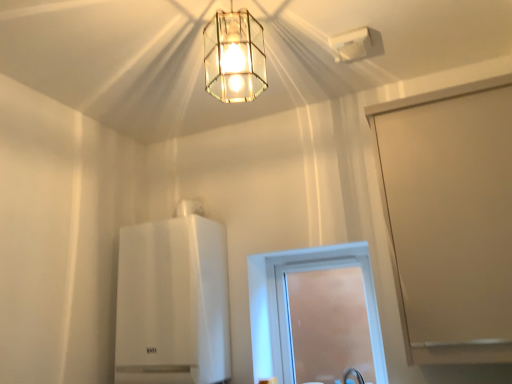
Question: In terms of height, does white plastic air vent at upper center, placed as the 1th lamp when sorted from right to left, look taller or shorter compared to clear glass pendant light at upper center, placed as the first lamp when sorted from left to right?

Choices:
 (A) short
 (B) tall

Answer: (A)

Question: Based on their sizes in the image, would you say white plastic air vent at upper center, which is the first lamp from back to front, is bigger or smaller than clear glass pendant light at upper center, which is the 2th lamp in back-to-front order?

Choices:
 (A) big
 (B) small

Answer: (B)

Question: Estimate the real-world distances between objects in this image. Which object is farther from the clear glass window at center?

Choices:
 (A) white glossy boiler at center
 (B) clear glass pendant light at upper center, which is the 2th lamp in back-to-front order
 (C) white plastic air vent at upper center, which is the first lamp from back to front
 (D) beige matte screen door at right

Answer: (C)

Question: Which object is the farthest from the beige matte screen door at right?

Choices:
 (A) white plastic air vent at upper center, placed as the 1th lamp when sorted from right to left
 (B) clear glass window at center
 (C) clear glass pendant light at upper center, which is the first lamp in front-to-back order
 (D) white glossy boiler at center

Answer: (D)